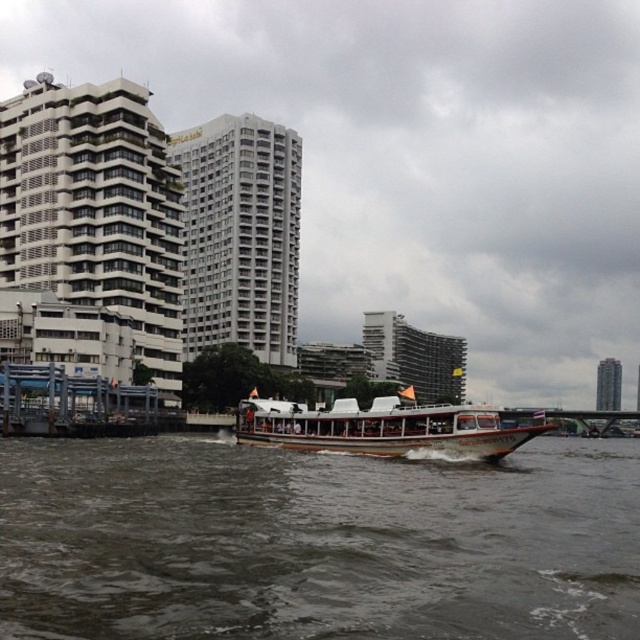
Question: Where is brown wooden boat at center located in relation to wooden polished boat at center in the image?

Choices:
 (A) above
 (B) below

Answer: (A)

Question: Is brown wooden boat at center in front of wooden polished boat at center?

Choices:
 (A) no
 (B) yes

Answer: (B)

Question: Is brown wooden boat at center wider than wooden polished boat at center?

Choices:
 (A) yes
 (B) no

Answer: (A)